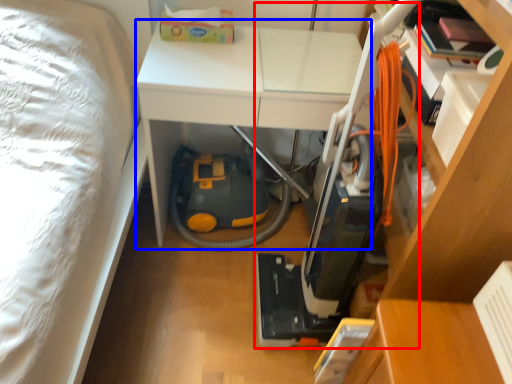
Question: Which point is closer to the camera, vacuum (highlighted by a red box) or table (highlighted by a blue box)?

Choices:
 (A) vacuum
 (B) table

Answer: (A)